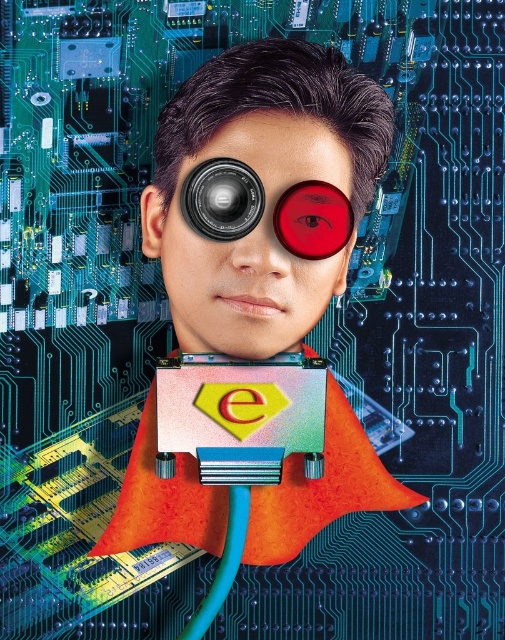
Question: Which object appears farthest from the camera in this image?

Choices:
 (A) black metallic lens at center
 (B) matte black lens at center

Answer: (B)

Question: Which point is farther from the camera taking this photo?

Choices:
 (A) (242, 172)
 (B) (312, 490)

Answer: (B)

Question: Does matte black lens at center lie behind black metallic lens at center?

Choices:
 (A) no
 (B) yes

Answer: (B)

Question: Which object is positioned farthest from the metallic circuit board at center?

Choices:
 (A) matte black lens at center
 (B) black metallic lens at center

Answer: (B)

Question: Does metallic circuit board at center have a lesser width compared to matte black lens at center?

Choices:
 (A) yes
 (B) no

Answer: (B)

Question: Is matte black lens at center positioned in front of black metallic lens at center?

Choices:
 (A) yes
 (B) no

Answer: (B)